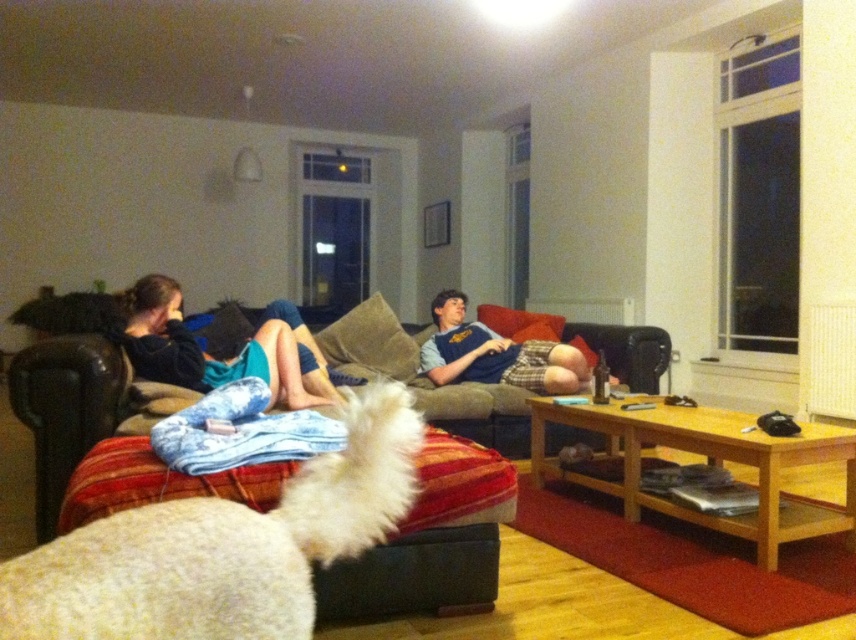
In the scene shown: Is blue denim shorts at left thinner than blue jersey at center?

Correct, blue denim shorts at left's width is less than blue jersey at center's.

What do you see at coordinates (218, 358) in the screenshot? I see `blue denim shorts at left` at bounding box center [218, 358].

Locate an element on the screen. The image size is (856, 640). blue denim shorts at left is located at coordinates (218, 358).

Based on the photo, measure the distance from white fluffy dog at lower left to blue denim shorts at left.

A distance of 2.08 meters exists between white fluffy dog at lower left and blue denim shorts at left.

Is white fluffy dog at lower left above blue denim shorts at left?

No.

Describe the element at coordinates (223, 547) in the screenshot. I see `white fluffy dog at lower left` at that location.

Image resolution: width=856 pixels, height=640 pixels. Identify the location of white fluffy dog at lower left. (223, 547).

Which of these two, white fluffy dog at lower left or blue jersey at center, stands shorter?

white fluffy dog at lower left

Is white fluffy dog at lower left bigger than blue jersey at center?

No, white fluffy dog at lower left is not bigger than blue jersey at center.

Describe the element at coordinates (223, 547) in the screenshot. This screenshot has height=640, width=856. I see `white fluffy dog at lower left` at that location.

This screenshot has width=856, height=640. What are the coordinates of `white fluffy dog at lower left` in the screenshot? It's located at (223, 547).